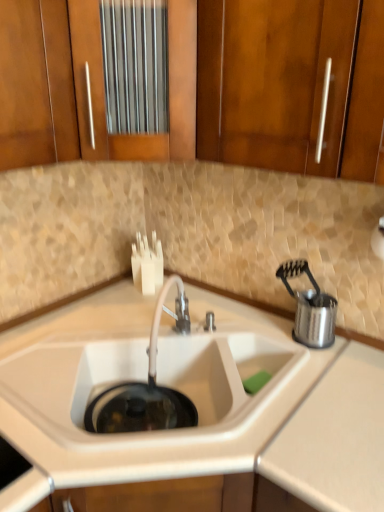
Question: Is white matte sink at center to the left or to the right of satin nickel faucet at center in the image?

Choices:
 (A) right
 (B) left

Answer: (B)

Question: Considering the positions of white matte sink at center and satin nickel faucet at center in the image, is white matte sink at center bigger or smaller than satin nickel faucet at center?

Choices:
 (A) big
 (B) small

Answer: (A)

Question: Based on their relative distances, which object is nearer to the wooden cabinet at upper left, the second cabinetry when ordered from right to left?

Choices:
 (A) satin nickel faucet at center
 (B) wooden cabinet at upper center, acting as the second cabinetry starting from the left
 (C) stainless steel utensil holder at right
 (D) white matte sink at center

Answer: (B)

Question: Which is farther from the wooden cabinet at upper center, marked as the first cabinetry in a right-to-left arrangement?

Choices:
 (A) wooden cabinet at upper left, the second cabinetry when ordered from right to left
 (B) white matte sink at center
 (C) stainless steel utensil holder at right
 (D) satin nickel faucet at center

Answer: (C)